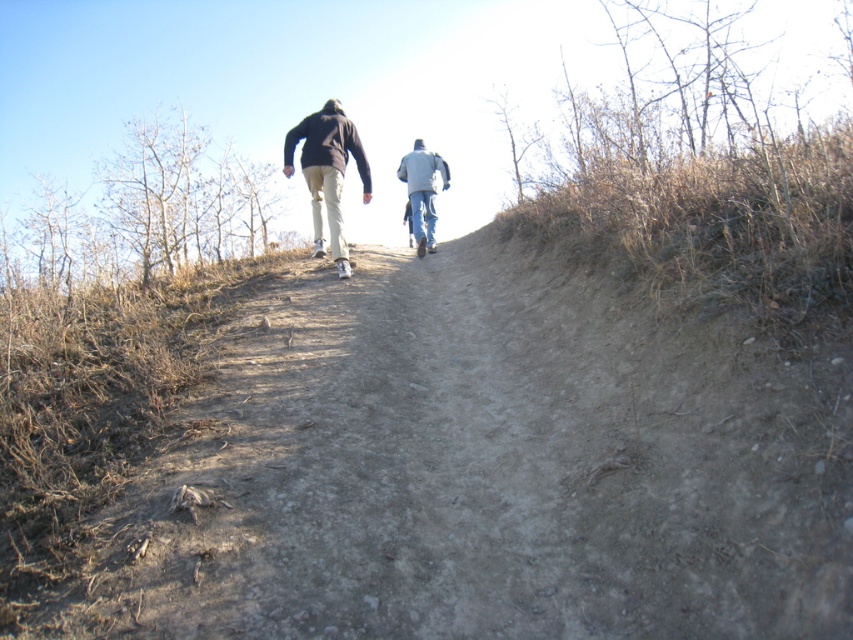
Measure the distance between dark brown hoodie at center and light blue jeans at center.

dark brown hoodie at center is 1.38 meters from light blue jeans at center.

Does dark brown hoodie at center appear on the left side of light blue jeans at center?

Indeed, dark brown hoodie at center is positioned on the left side of light blue jeans at center.

Does point (369, 195) come closer to viewer compared to point (405, 179)?

Yes, point (369, 195) is in front of point (405, 179).

This screenshot has width=853, height=640. What are the coordinates of `dark brown hoodie at center` in the screenshot? It's located at (328, 172).

How much distance is there between dull gray dirt track at center and dark brown hoodie at center?

dull gray dirt track at center and dark brown hoodie at center are 2.26 meters apart.

Can you confirm if dull gray dirt track at center is smaller than dark brown hoodie at center?

No.

Which is in front, point (494, 372) or point (320, 154)?

Positioned in front is point (494, 372).

At what (x,y) coordinates should I click in order to perform the action: click on dull gray dirt track at center. Please return your answer as a coordinate pair (x, y). The height and width of the screenshot is (640, 853). Looking at the image, I should click on [x=485, y=468].

Can you confirm if dull gray dirt track at center is positioned to the left of light blue jeans at center?

Indeed, dull gray dirt track at center is positioned on the left side of light blue jeans at center.

Between point (357, 483) and point (410, 230), which one is positioned behind?

The point (410, 230) is behind.

Between point (291, 284) and point (427, 240), which one is positioned behind?

Positioned behind is point (427, 240).

This screenshot has width=853, height=640. Find the location of `dull gray dirt track at center`. dull gray dirt track at center is located at coordinates (485, 468).